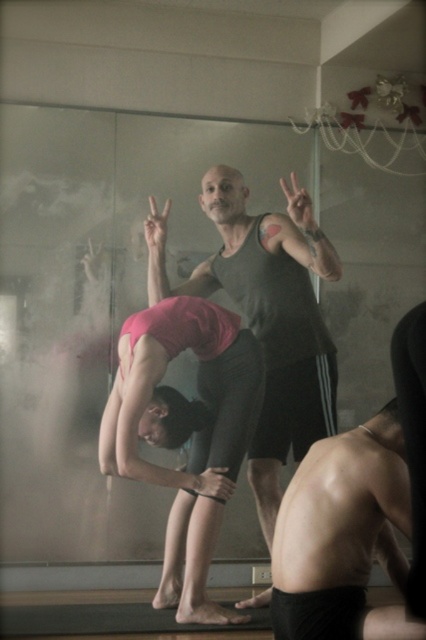
Looking at this image, which is below, matte black tank top at center or pink matte yoga pants at center?

pink matte yoga pants at center is below.

Is matte black tank top at center bigger than pink matte yoga pants at center?

Indeed, matte black tank top at center has a larger size compared to pink matte yoga pants at center.

In order to click on matte black tank top at center in this screenshot , I will do `click(267, 316)`.